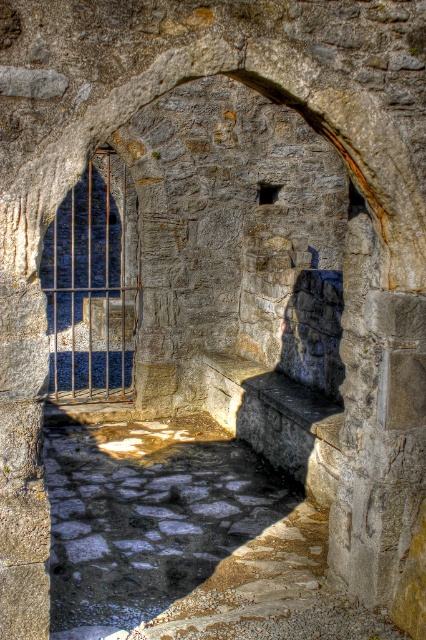
Question: Can you confirm if stone cobblestone pathway at center is thinner than rusty metal gate at center?

Choices:
 (A) yes
 (B) no

Answer: (B)

Question: Can you confirm if stone cobblestone pathway at center is positioned to the right of rusty metal gate at center?

Choices:
 (A) no
 (B) yes

Answer: (B)

Question: Can you confirm if stone cobblestone pathway at center is positioned above rusty metal gate at center?

Choices:
 (A) yes
 (B) no

Answer: (B)

Question: Which of the following is the closest to the observer?

Choices:
 (A) stone cobblestone pathway at center
 (B) rusty metal gate at center

Answer: (A)

Question: Which of the following is the closest to the observer?

Choices:
 (A) (98, 308)
 (B) (322, 580)

Answer: (B)